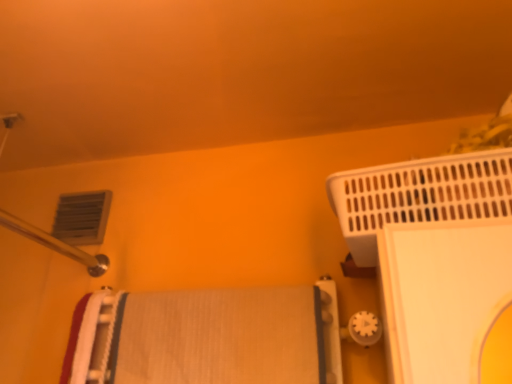
Identify the location of white plastic bath heater at upper right. The width and height of the screenshot is (512, 384). [419, 195].

Identify the location of white textured bath towel at center. Image resolution: width=512 pixels, height=384 pixels. (222, 337).

Locate an element on the screen. matte plastic air conditioning at upper left is located at coordinates (82, 217).

How many degrees apart are the facing directions of white plastic bath heater at upper right and matte plastic air conditioning at upper left?

4 degrees.

From a real-world perspective, is white plastic bath heater at upper right physically below matte plastic air conditioning at upper left?

Indeed, from a real-world perspective, white plastic bath heater at upper right is positioned beneath matte plastic air conditioning at upper left.

Can you confirm if white plastic bath heater at upper right is shorter than matte plastic air conditioning at upper left?

No.

Which is further, [368,236] or [68,224]?

Positioned behind is point [68,224].

At what (x,y) coordinates should I click in order to perform the action: click on bath towel below the white plastic bath heater at upper right (from the image's perspective). Please return your answer as a coordinate pair (x, y). Looking at the image, I should click on (222, 337).

From a real-world perspective, which is physically below, white textured bath towel at center or white plastic bath heater at upper right?

white textured bath towel at center is physically lower.

Is white textured bath towel at center surrounding white plastic bath heater at upper right?

Definitely not — white plastic bath heater at upper right is not inside white textured bath towel at center.

How different are the orientations of white textured bath towel at center and white plastic bath heater at upper right in degrees?

4.29 degrees.

Is white textured bath towel at center not close to matte plastic air conditioning at upper left?

No, there isn't a large distance between white textured bath towel at center and matte plastic air conditioning at upper left.

Does white textured bath towel at center have a smaller size compared to matte plastic air conditioning at upper left?

Actually, white textured bath towel at center might be larger than matte plastic air conditioning at upper left.

In terms of height, does white textured bath towel at center look taller or shorter compared to matte plastic air conditioning at upper left?

In the image, white textured bath towel at center appears to be taller than matte plastic air conditioning at upper left.

Is white textured bath towel at center positioned beyond the bounds of matte plastic air conditioning at upper left?

Yes.

Is white plastic bath heater at upper right with white textured bath towel at center?

There is a gap between white plastic bath heater at upper right and white textured bath towel at center.

Considering the relative positions of white plastic bath heater at upper right and white textured bath towel at center in the image provided, is white plastic bath heater at upper right to the left of white textured bath towel at center from the viewer's perspective?

No, white plastic bath heater at upper right is not to the left of white textured bath towel at center.

You are a GUI agent. You are given a task and a screenshot of the screen. Output one action in this format:
    pyautogui.click(x=<x>, y=<y>)
    Task: Click on the bath heater on the right of the white textured bath towel at center
    
    Given the screenshot: What is the action you would take?
    pyautogui.click(x=419, y=195)

In the scene shown: Is white textured bath towel at center located within white plastic bath heater at upper right?

No, white textured bath towel at center is not surrounded by white plastic bath heater at upper right.

From the image's perspective, is matte plastic air conditioning at upper left beneath white textured bath towel at center?

Incorrect, from the image's perspective, matte plastic air conditioning at upper left is higher than white textured bath towel at center.

Looking at this image, between matte plastic air conditioning at upper left and white textured bath towel at center, which one has larger width?

Wider between the two is white textured bath towel at center.

From the picture: Which is in front, matte plastic air conditioning at upper left or white textured bath towel at center?

Positioned in front is white textured bath towel at center.

Find the location of a particular element. Image resolution: width=512 pixels, height=384 pixels. air conditioning that appears on the left of white textured bath towel at center is located at coordinates (82, 217).

Which is correct: matte plastic air conditioning at upper left is inside white plastic bath heater at upper right, or outside of it?

matte plastic air conditioning at upper left is not enclosed by white plastic bath heater at upper right.

Is matte plastic air conditioning at upper left at the left side of white plastic bath heater at upper right?

Indeed, matte plastic air conditioning at upper left is positioned on the left side of white plastic bath heater at upper right.

Which object is further away from the camera, matte plastic air conditioning at upper left or white plastic bath heater at upper right?

matte plastic air conditioning at upper left.

In order to click on air conditioning on the left of white plastic bath heater at upper right in this screenshot , I will do `click(82, 217)`.

I want to click on bath towel that is below the white plastic bath heater at upper right (from the image's perspective), so click(x=222, y=337).

Considering their positions, is white textured bath towel at center positioned further to matte plastic air conditioning at upper left than white plastic bath heater at upper right?

white plastic bath heater at upper right is positioned further to the anchor matte plastic air conditioning at upper left.

From the image, which object appears to be nearer to white textured bath towel at center, matte plastic air conditioning at upper left or white plastic bath heater at upper right?

white plastic bath heater at upper right.

From the image, which object appears to be farther from white textured bath towel at center, white plastic bath heater at upper right or matte plastic air conditioning at upper left?

matte plastic air conditioning at upper left lies further to white textured bath towel at center than the other object.

Estimate the real-world distances between objects in this image. Which object is further from white plastic bath heater at upper right, white textured bath towel at center or matte plastic air conditioning at upper left?

Among the two, matte plastic air conditioning at upper left is located further to white plastic bath heater at upper right.

Which object lies nearer to the anchor point matte plastic air conditioning at upper left, white plastic bath heater at upper right or white textured bath towel at center?

Among the two, white textured bath towel at center is located nearer to matte plastic air conditioning at upper left.

From the image, which object appears to be nearer to white plastic bath heater at upper right, matte plastic air conditioning at upper left or white textured bath towel at center?

white textured bath towel at center lies closer to white plastic bath heater at upper right than the other object.

At what (x,y) coordinates should I click in order to perform the action: click on bath towel situated between matte plastic air conditioning at upper left and white plastic bath heater at upper right from left to right. Please return your answer as a coordinate pair (x, y). The width and height of the screenshot is (512, 384). Looking at the image, I should click on (222, 337).